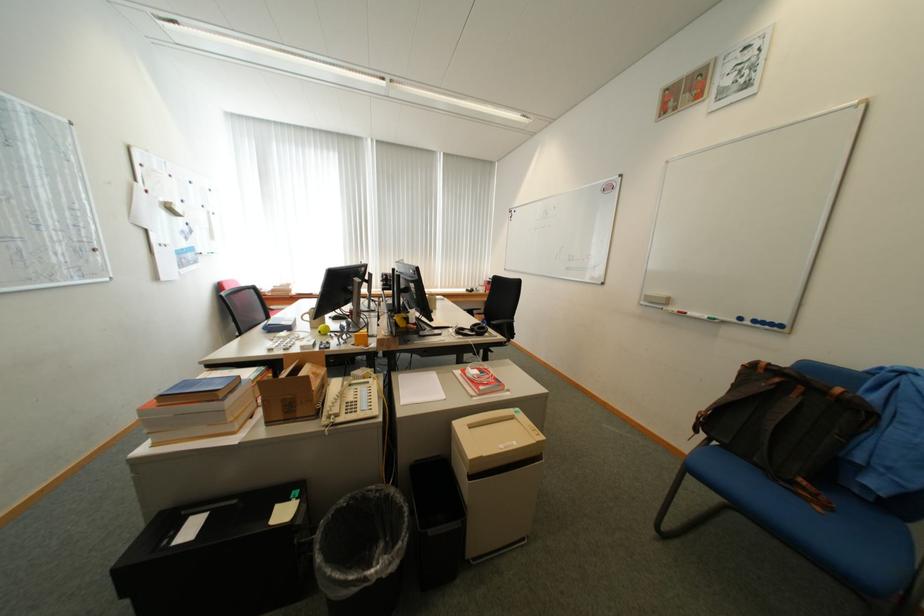
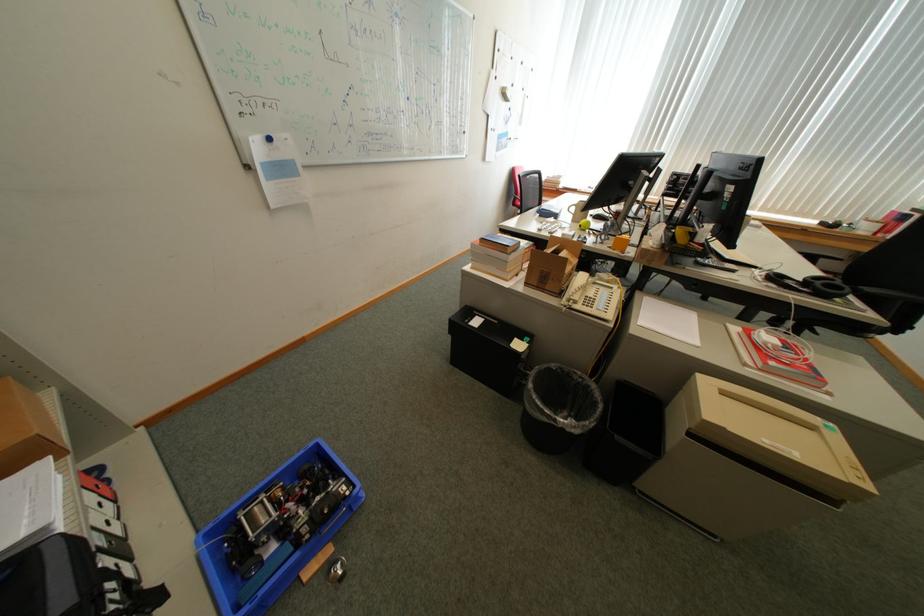
Locate, in the second image, the point that corresponds to (x=323, y=395) in the first image.

(575, 277)